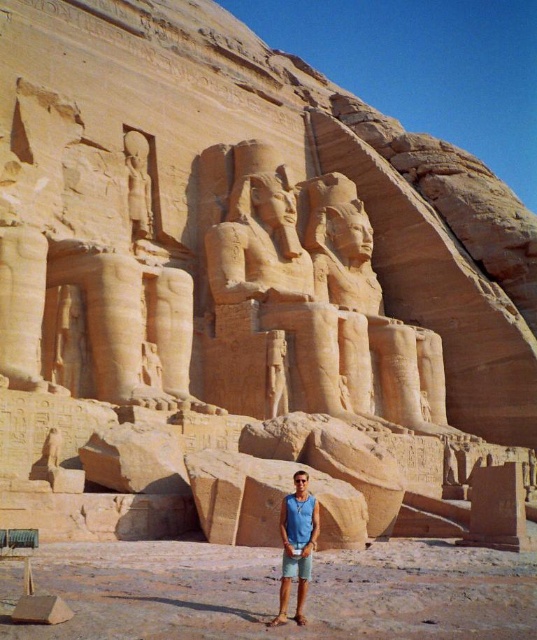
Question: In this image, where is blue fabric shirt at center located relative to smooth sandstone statue at upper left?

Choices:
 (A) left
 (B) right

Answer: (B)

Question: Does blue fabric shirt at center have a smaller size compared to smooth sandstone statue at upper left?

Choices:
 (A) yes
 (B) no

Answer: (A)

Question: Can you confirm if blue fabric shirt at center is positioned below smooth sandstone statue at upper left?

Choices:
 (A) yes
 (B) no

Answer: (A)